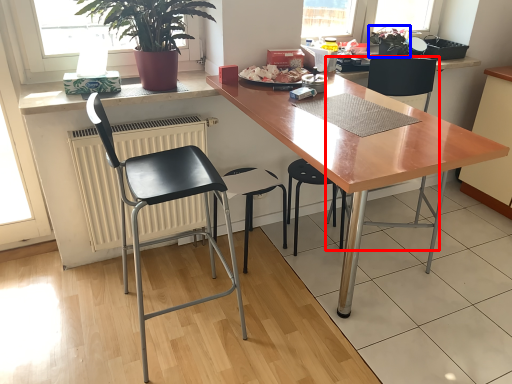
Question: Which object appears farthest to the camera in this image, chair (highlighted by a red box) or houseplant (highlighted by a blue box)?

Choices:
 (A) chair
 (B) houseplant

Answer: (B)